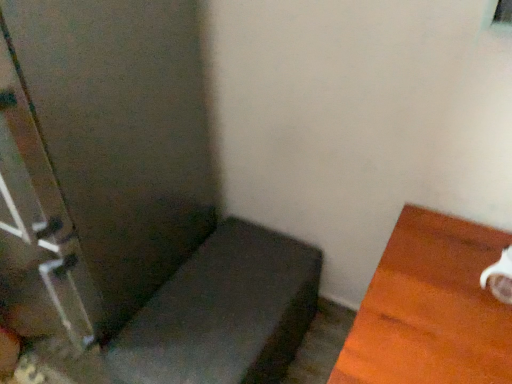
In order to face matte gray cushion at lower left, positioned as the 2th furniture in right-to-left order, should I rotate leftwards or rightwards?

You should look left and rotate roughly 3.587 degrees.

Image resolution: width=512 pixels, height=384 pixels. What are the coordinates of `clear glass screen door at left` in the screenshot? It's located at pos(101,156).

The image size is (512, 384). Find the location of `matte gray cushion at lower left, which is counted as the 1th furniture, starting from the left`. matte gray cushion at lower left, which is counted as the 1th furniture, starting from the left is located at coordinates (224, 313).

Is clear glass screen door at left beside matte gray cushion at lower left, which is counted as the 1th furniture, starting from the left?

They are not placed beside each other.

At what (x,y) coordinates should I click in order to perform the action: click on the 1st furniture to the right when counting from the clear glass screen door at left. Please return your answer as a coordinate pair (x, y). The image size is (512, 384). Looking at the image, I should click on (224, 313).

Considering the sizes of objects clear glass screen door at left and matte gray cushion at lower left, positioned as the 2th furniture in right-to-left order, in the image provided, who is shorter, clear glass screen door at left or matte gray cushion at lower left, positioned as the 2th furniture in right-to-left order,?

matte gray cushion at lower left, positioned as the 2th furniture in right-to-left order.

From a real-world perspective, is clear glass screen door at left above or below matte gray cushion at lower left, which is counted as the 1th furniture, starting from the left?

From a real-world perspective, clear glass screen door at left is physically above matte gray cushion at lower left, which is counted as the 1th furniture, starting from the left.

From the image's perspective, is matte gray cushion at lower left, positioned as the 2th furniture in right-to-left order, on top of clear glass screen door at left?

No, from the image's perspective, matte gray cushion at lower left, positioned as the 2th furniture in right-to-left order, is not above clear glass screen door at left.

From a real-world perspective, is matte gray cushion at lower left, which is counted as the 1th furniture, starting from the left, located higher than clear glass screen door at left?

Incorrect, from a real-world perspective, matte gray cushion at lower left, which is counted as the 1th furniture, starting from the left, is lower than clear glass screen door at left.

Considering the positions of point (292, 347) and point (59, 281), is point (292, 347) closer or farther from the camera than point (59, 281)?

Point (292, 347) is positioned farther from the camera compared to point (59, 281).

Which of these two, matte gray cushion at lower left, which is counted as the 1th furniture, starting from the left, or clear glass screen door at left, is wider?

clear glass screen door at left.

Are clear glass screen door at left and white glossy mug at right, which is the 2th furniture from left to right, far apart?

Actually, clear glass screen door at left and white glossy mug at right, which is the 2th furniture from left to right, are a little close together.

Looking at this image, from a real-world perspective, which is physically above, clear glass screen door at left or white glossy mug at right, which is the 2th furniture from left to right?

clear glass screen door at left is physically above.

From the image's perspective, which is below, clear glass screen door at left or white glossy mug at right, which is the 2th furniture from left to right?

From the image's view, white glossy mug at right, which is the 2th furniture from left to right, is below.

Is white glossy mug at right, which is the first furniture from right to left, at the back of clear glass screen door at left?

No, clear glass screen door at left is not facing away from white glossy mug at right, which is the first furniture from right to left.

Find the location of a particular element. screen door above the white glossy mug at right, which is the first furniture from right to left (from the image's perspective) is located at coordinates (101, 156).

Which object is closer to the camera, white glossy mug at right, which is the 2th furniture from left to right, or clear glass screen door at left?

white glossy mug at right, which is the 2th furniture from left to right, is in front.

Considering the relative positions of white glossy mug at right, which is the 2th furniture from left to right, and clear glass screen door at left in the image provided, is white glossy mug at right, which is the 2th furniture from left to right, to the right of clear glass screen door at left from the viewer's perspective?

Correct, you'll find white glossy mug at right, which is the 2th furniture from left to right, to the right of clear glass screen door at left.

From the image's perspective, would you say matte gray cushion at lower left, which is counted as the 1th furniture, starting from the left, is shown under white glossy mug at right, which is the first furniture from right to left?

No, from the image's perspective, matte gray cushion at lower left, which is counted as the 1th furniture, starting from the left, is not beneath white glossy mug at right, which is the first furniture from right to left.

Is matte gray cushion at lower left, which is counted as the 1th furniture, starting from the left, outside of white glossy mug at right, which is the first furniture from right to left?

That's correct, matte gray cushion at lower left, which is counted as the 1th furniture, starting from the left, is outside of white glossy mug at right, which is the first furniture from right to left.

Considering the relative sizes of matte gray cushion at lower left, positioned as the 2th furniture in right-to-left order, and white glossy mug at right, which is the first furniture from right to left, in the image provided, is matte gray cushion at lower left, positioned as the 2th furniture in right-to-left order, shorter than white glossy mug at right, which is the first furniture from right to left,?

Indeed, matte gray cushion at lower left, positioned as the 2th furniture in right-to-left order, has a lesser height compared to white glossy mug at right, which is the first furniture from right to left.

Which object is further away from the camera taking this photo, matte gray cushion at lower left, which is counted as the 1th furniture, starting from the left, or white glossy mug at right, which is the 2th furniture from left to right?

matte gray cushion at lower left, which is counted as the 1th furniture, starting from the left.

From the image's perspective, which is below, white glossy mug at right, which is the first furniture from right to left, or matte gray cushion at lower left, positioned as the 2th furniture in right-to-left order?

From the image's view, white glossy mug at right, which is the first furniture from right to left, is below.

From their relative heights in the image, would you say white glossy mug at right, which is the first furniture from right to left, is taller or shorter than matte gray cushion at lower left, which is counted as the 1th furniture, starting from the left?

white glossy mug at right, which is the first furniture from right to left, is taller than matte gray cushion at lower left, which is counted as the 1th furniture, starting from the left.

Can you confirm if white glossy mug at right, which is the 2th furniture from left to right, is smaller than matte gray cushion at lower left, which is counted as the 1th furniture, starting from the left?

Incorrect, white glossy mug at right, which is the 2th furniture from left to right, is not smaller in size than matte gray cushion at lower left, which is counted as the 1th furniture, starting from the left.

In the image, there is a matte gray cushion at lower left, positioned as the 2th furniture in right-to-left order. Where is `screen door above it (from the image's perspective)`? This screenshot has width=512, height=384. screen door above it (from the image's perspective) is located at coordinates (101, 156).

There is a clear glass screen door at left. Identify the location of the 1st furniture below it (from the image's perspective). This screenshot has width=512, height=384. (224, 313).

Which object lies nearer to the anchor point white glossy mug at right, which is the first furniture from right to left, matte gray cushion at lower left, which is counted as the 1th furniture, starting from the left, or clear glass screen door at left?

Among the two, matte gray cushion at lower left, which is counted as the 1th furniture, starting from the left, is located nearer to white glossy mug at right, which is the first furniture from right to left.

From the image, which object appears to be nearer to matte gray cushion at lower left, positioned as the 2th furniture in right-to-left order, white glossy mug at right, which is the first furniture from right to left, or clear glass screen door at left?

clear glass screen door at left is closer to matte gray cushion at lower left, positioned as the 2th furniture in right-to-left order.

Based on their spatial positions, is clear glass screen door at left or matte gray cushion at lower left, positioned as the 2th furniture in right-to-left order, closer to white glossy mug at right, which is the first furniture from right to left?

Based on the image, matte gray cushion at lower left, positioned as the 2th furniture in right-to-left order, appears to be nearer to white glossy mug at right, which is the first furniture from right to left.

When comparing their distances from clear glass screen door at left, does white glossy mug at right, which is the 2th furniture from left to right, or matte gray cushion at lower left, which is counted as the 1th furniture, starting from the left, seem closer?

Based on the image, matte gray cushion at lower left, which is counted as the 1th furniture, starting from the left, appears to be nearer to clear glass screen door at left.

Estimate the real-world distances between objects in this image. Which object is closer to clear glass screen door at left, matte gray cushion at lower left, which is counted as the 1th furniture, starting from the left, or white glossy mug at right, which is the first furniture from right to left?

matte gray cushion at lower left, which is counted as the 1th furniture, starting from the left, is closer to clear glass screen door at left.

Based on their spatial positions, is clear glass screen door at left or white glossy mug at right, which is the 2th furniture from left to right, closer to matte gray cushion at lower left, which is counted as the 1th furniture, starting from the left?

clear glass screen door at left.

At what (x,y) coordinates should I click in order to perform the action: click on furniture between clear glass screen door at left and white glossy mug at right, which is the first furniture from right to left. Please return your answer as a coordinate pair (x, y). Looking at the image, I should click on (224, 313).